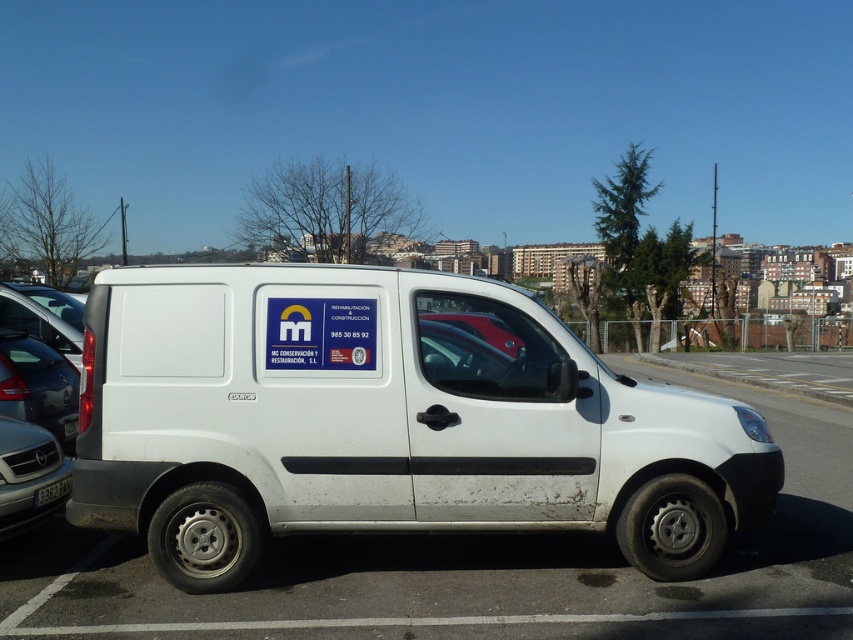
Does white matte van at center have a smaller size compared to silver metallic car at lower left?

Incorrect, white matte van at center is not smaller in size than silver metallic car at lower left.

Can you confirm if white matte van at center is taller than silver metallic car at lower left?

Indeed, white matte van at center has a greater height compared to silver metallic car at lower left.

Identify the location of white matte van at center. (386, 420).

Can you confirm if white matte van at center is positioned above black plastic license plate at lower left?

Correct, white matte van at center is located above black plastic license plate at lower left.

Consider the image. How much distance is there between white matte van at center and black plastic license plate at lower left?

A distance of 6.63 feet exists between white matte van at center and black plastic license plate at lower left.

Locate an element on the screen. The width and height of the screenshot is (853, 640). white matte van at center is located at coordinates (386, 420).

Is silver metallic car at lower left bigger than black plastic license plate at lower left?

Yes.

How far apart are silver metallic car at lower left and black plastic license plate at lower left?

They are 6.85 inches apart.

Measure the distance between point (38, 486) and camera.

Point (38, 486) is 4.71 meters from camera.

This screenshot has width=853, height=640. I want to click on silver metallic car at lower left, so click(28, 476).